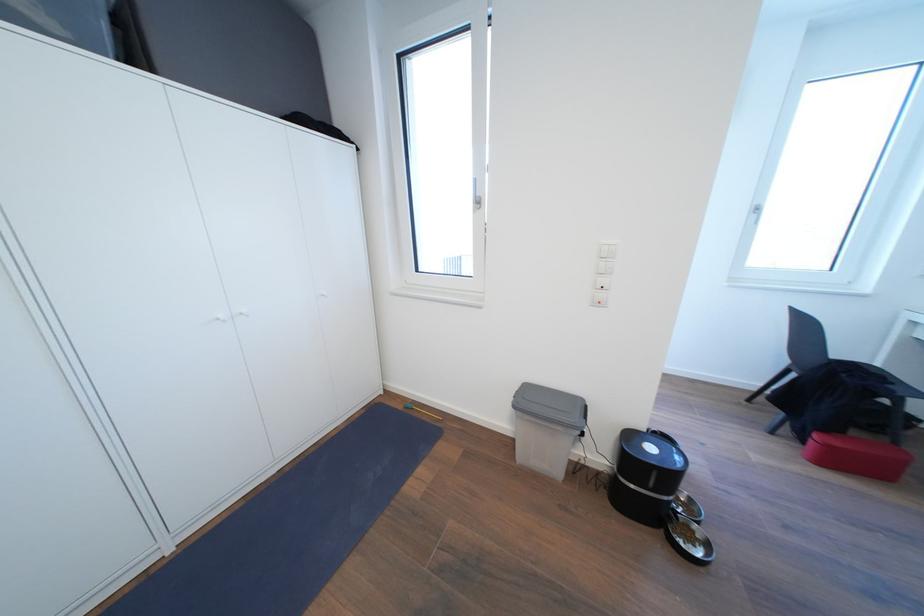
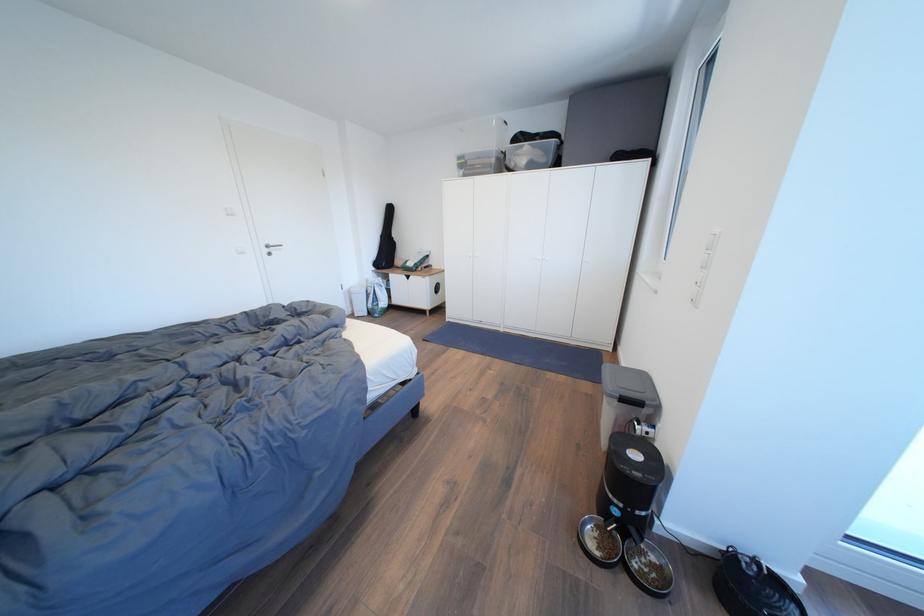
Locate, in the second image, the point that corresponds to point (659, 454) in the first image.

(642, 460)